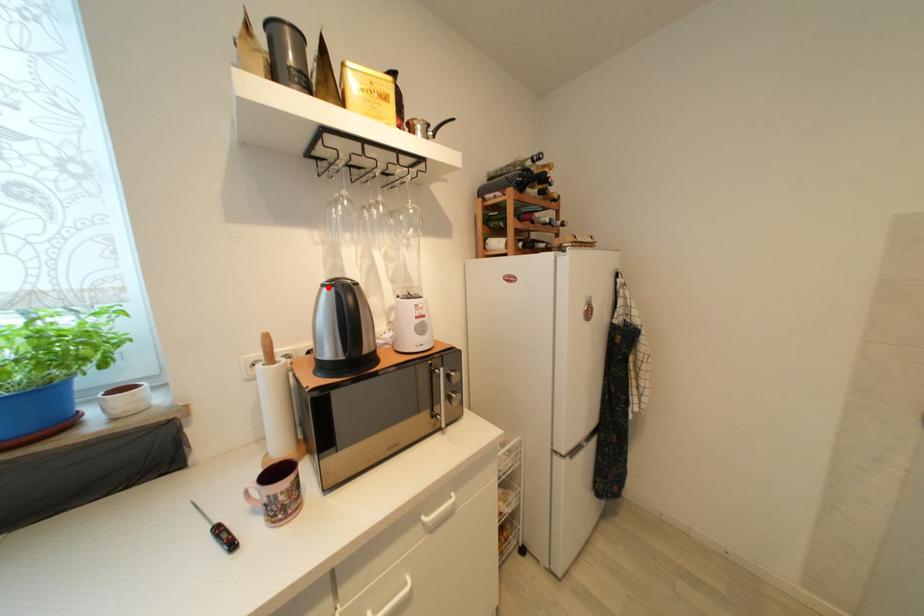
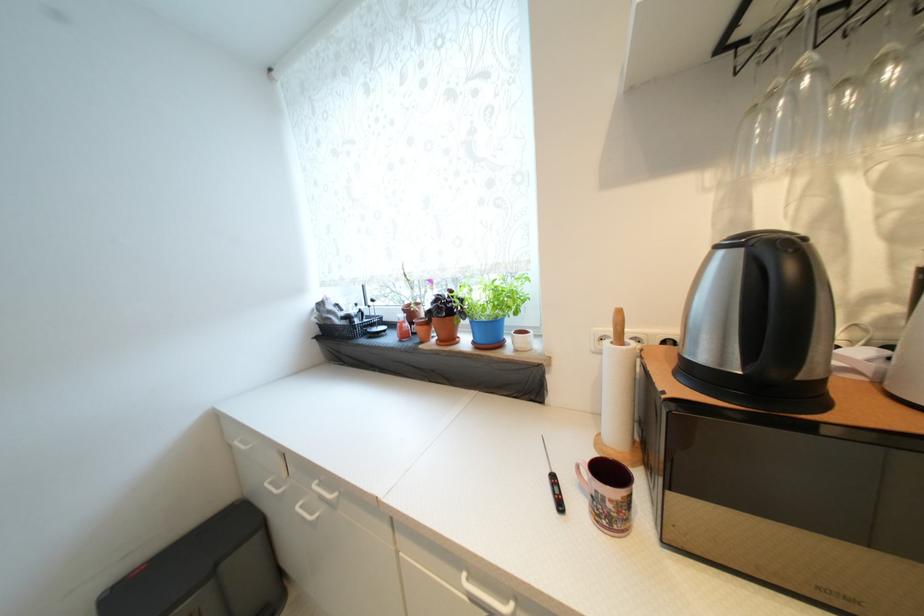
Locate, in the second image, the point that corresponds to the highlighted location in the first image.

(723, 249)